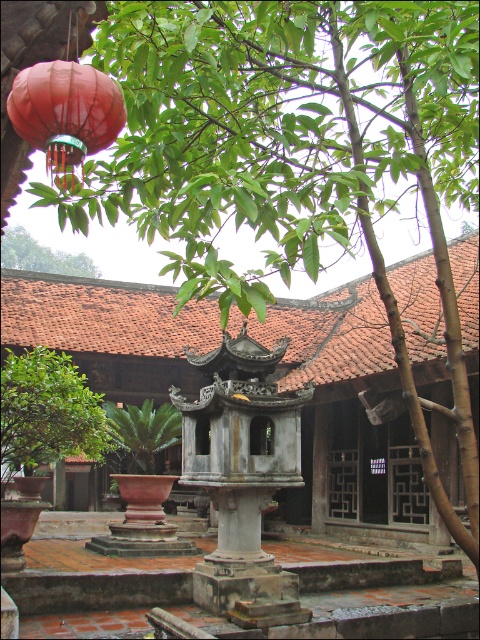
Question: Is matte red lantern at upper left above green leafy tree at upper center?

Choices:
 (A) no
 (B) yes

Answer: (A)

Question: Among these points, which one is farthest from the camera?

Choices:
 (A) (36, 246)
 (B) (112, 99)
 (C) (179, 435)
 (D) (20, 403)

Answer: (A)

Question: Is green leafy plant at center above green leafy tree at upper center?

Choices:
 (A) no
 (B) yes

Answer: (A)

Question: Which point is closer to the camera?

Choices:
 (A) (64, 268)
 (B) (24, 125)
 (C) (133, 452)

Answer: (B)

Question: From the image, what is the correct spatial relationship of matte red lantern at upper left in relation to green leafy plant at center?

Choices:
 (A) above
 (B) below

Answer: (A)

Question: Among these points, which one is farthest from the camera?

Choices:
 (A) (24, 96)
 (B) (177, 436)
 (C) (43, 442)

Answer: (B)